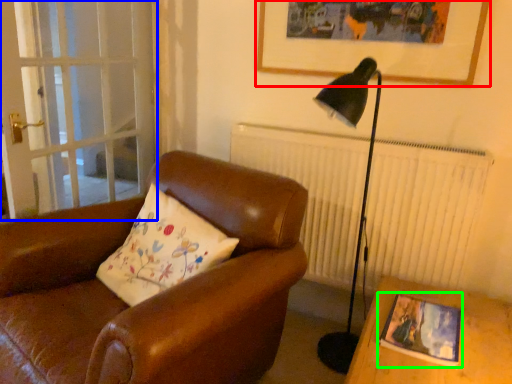
Question: Which object is the closest to the picture frame (highlighted by a red box)? Choose among these: screen door (highlighted by a blue box) or picture frame (highlighted by a green box).

Choices:
 (A) screen door
 (B) picture frame

Answer: (B)